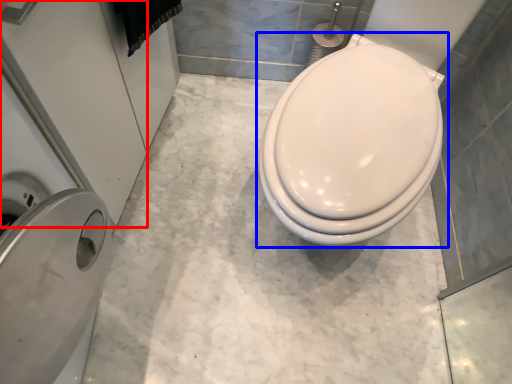
Question: Which of the following is the closest to the observer, screen door (highlighted by a red box) or toilet (highlighted by a blue box)?

Choices:
 (A) screen door
 (B) toilet

Answer: (A)